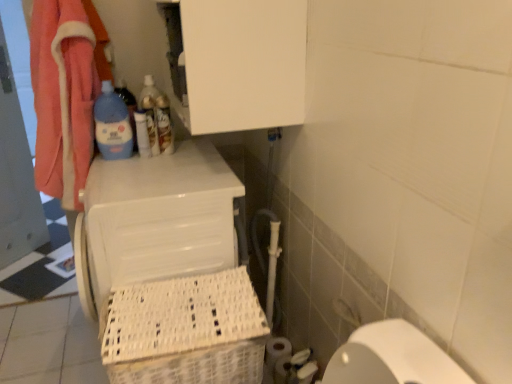
Question: Does white plastic laundry basket at lower left have a greater height compared to white matte toilet paper at lower right, the third toilet paper viewed from the back?

Choices:
 (A) no
 (B) yes

Answer: (B)

Question: Is white matte toilet paper at lower right, the third toilet paper viewed from the back, at the back of white plastic laundry basket at lower left?

Choices:
 (A) yes
 (B) no

Answer: (B)

Question: Considering the relative sizes of white plastic laundry basket at lower left and white matte toilet paper at lower right, which is the 1th toilet paper in front-to-back order, in the image provided, is white plastic laundry basket at lower left bigger than white matte toilet paper at lower right, which is the 1th toilet paper in front-to-back order,?

Choices:
 (A) no
 (B) yes

Answer: (B)

Question: Could you tell me if white plastic laundry basket at lower left is turned towards white matte toilet paper at lower right, the third toilet paper viewed from the back?

Choices:
 (A) yes
 (B) no

Answer: (B)

Question: Does white plastic laundry basket at lower left contain white matte toilet paper at lower right, which is the 1th toilet paper in front-to-back order?

Choices:
 (A) no
 (B) yes

Answer: (A)

Question: Considering the positions of point (266, 362) and point (102, 102), is point (266, 362) closer or farther from the camera than point (102, 102)?

Choices:
 (A) closer
 (B) farther

Answer: (A)

Question: Considering the positions of white matte toilet paper at lower right, the third toilet paper in the front-to-back sequence, and blue glossy bottle at upper left, arranged as the first bottle when viewed from the left, in the image, is white matte toilet paper at lower right, the third toilet paper in the front-to-back sequence, wider or thinner than blue glossy bottle at upper left, arranged as the first bottle when viewed from the left,?

Choices:
 (A) thin
 (B) wide

Answer: (B)

Question: Is white matte toilet paper at lower right, the first toilet paper viewed from the back, to the left or to the right of blue glossy bottle at upper left, marked as the 3th bottle in a right-to-left arrangement, in the image?

Choices:
 (A) right
 (B) left

Answer: (A)

Question: In terms of height, does white matte toilet paper at lower right, the first toilet paper viewed from the back, look taller or shorter compared to blue glossy bottle at upper left, arranged as the first bottle when viewed from the left?

Choices:
 (A) tall
 (B) short

Answer: (B)

Question: From a real-world perspective, is white matte toilet paper at lower right, placed as the second toilet paper when sorted from front to back, physically located above or below white matte toilet paper at lower right, which is the 1th toilet paper in front-to-back order?

Choices:
 (A) below
 (B) above

Answer: (B)

Question: From the image's perspective, relative to white matte toilet paper at lower right, which is the 1th toilet paper in front-to-back order, is white matte toilet paper at lower right, which is the 2th toilet paper in back-to-front order, above or below?

Choices:
 (A) below
 (B) above

Answer: (B)

Question: Considering the positions of white matte toilet paper at lower right, which is the 2th toilet paper in back-to-front order, and white matte toilet paper at lower right, which is the 1th toilet paper in front-to-back order, in the image, is white matte toilet paper at lower right, which is the 2th toilet paper in back-to-front order, wider or thinner than white matte toilet paper at lower right, which is the 1th toilet paper in front-to-back order,?

Choices:
 (A) wide
 (B) thin

Answer: (B)

Question: Visually, is white matte toilet paper at lower right, which is the 2th toilet paper in back-to-front order, positioned to the left or to the right of white matte toilet paper at lower right, which is the 1th toilet paper in front-to-back order?

Choices:
 (A) right
 (B) left

Answer: (B)

Question: Do you think translucent plastic bottle at upper center, placed as the 2th bottle when sorted from right to left, is within white matte toilet paper at lower right, which is the 2th toilet paper in back-to-front order, or outside of it?

Choices:
 (A) inside
 (B) outside

Answer: (B)

Question: Based on their sizes in the image, would you say translucent plastic bottle at upper center, which is the second bottle in left-to-right order, is bigger or smaller than white matte toilet paper at lower right, which is the 2th toilet paper in back-to-front order?

Choices:
 (A) small
 (B) big

Answer: (A)